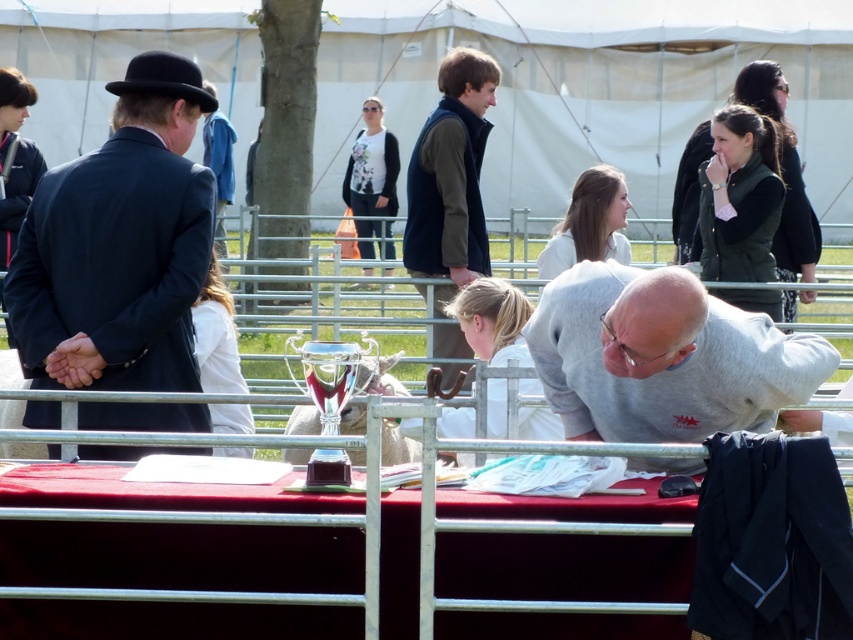
Does matte black bowler hat at left have a larger size compared to white glossy trophy at center?

Yes.

Consider the image. Can you confirm if matte black bowler hat at left is positioned to the right of white glossy trophy at center?

Incorrect, matte black bowler hat at left is not on the right side of white glossy trophy at center.

Does point (80, 209) lie behind point (311, 412)?

No, (80, 209) is closer to viewer.

Locate an element on the screen. Image resolution: width=853 pixels, height=640 pixels. matte black bowler hat at left is located at coordinates (119, 244).

Which of these two, white fabric canopy at upper center or gray matte sweatshirt at center, stands taller?

Standing taller between the two is gray matte sweatshirt at center.

Does point (202, 8) come in front of point (691, 387)?

No, (202, 8) is further to viewer.

Locate an element on the screen. This screenshot has height=640, width=853. white fabric canopy at upper center is located at coordinates (589, 88).

Which is more to the right, matte black bowler hat at left or shiny silver trophy at center?

Positioned to the right is matte black bowler hat at left.

Between point (126, 177) and point (0, 385), which one is positioned in front?

Point (126, 177)

Locate an element on the screen. The width and height of the screenshot is (853, 640). matte black bowler hat at left is located at coordinates (119, 244).